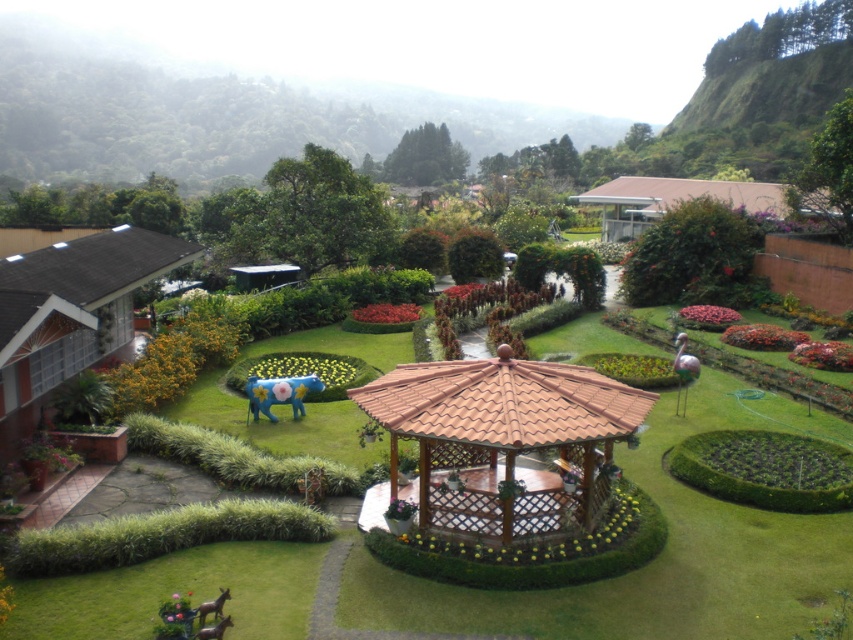
Which is in front, point (718, 532) or point (213, 604)?

Point (213, 604) is more forward.

Who is more distant from viewer, (213,550) or (202,602)?

The point (213,550) is behind.

Who is more forward, (602, 627) or (202, 605)?

Point (202, 605)

This screenshot has height=640, width=853. Find the location of `green grass at center`. green grass at center is located at coordinates (659, 556).

Which of these two, brown wooden gazebo at center or brown wooden horse at lower left, stands shorter?

brown wooden gazebo at center

Between brown wooden gazebo at center and brown wooden horse at lower left, which one has more height?

brown wooden horse at lower left

You are a GUI agent. You are given a task and a screenshot of the screen. Output one action in this format:
    pyautogui.click(x=<x>, y=<y>)
    Task: Click on the brown wooden gazebo at center
    This screenshot has height=640, width=853.
    Given the screenshot: What is the action you would take?
    pyautogui.click(x=503, y=440)

Locate an element on the screen. The width and height of the screenshot is (853, 640). brown wooden gazebo at center is located at coordinates (503, 440).

Is green grass at center wider than brown wooden gazebo at center?

Yes, green grass at center is wider than brown wooden gazebo at center.

Is green grass at center closer to the viewer compared to brown wooden gazebo at center?

Yes, green grass at center is in front of brown wooden gazebo at center.

This screenshot has height=640, width=853. What are the coordinates of `green grass at center` in the screenshot? It's located at (659, 556).